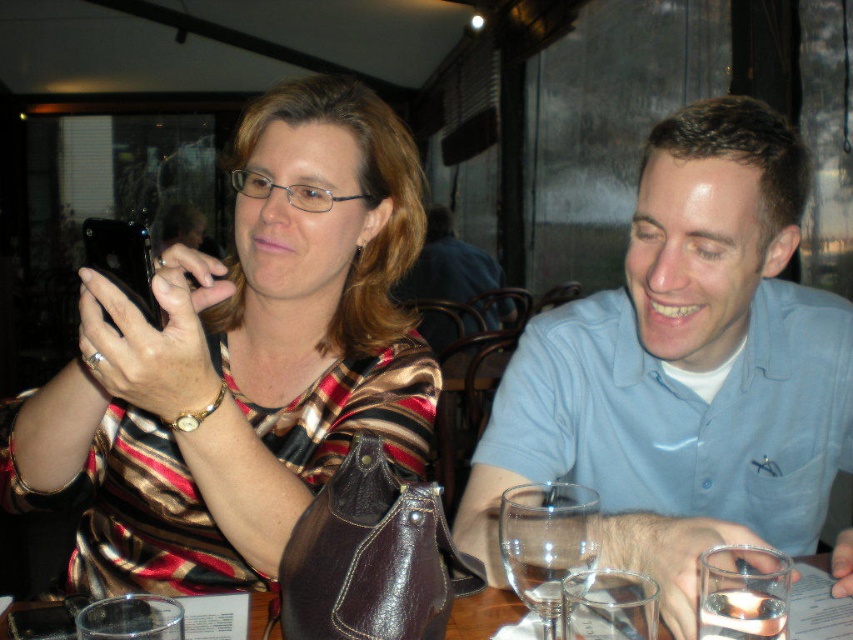
You are a waiter at a restaurant and need to place a 12.5 inch long menu between the blue cotton shirt at center and the transparent glassware at center. Can you fit it there?

The blue cotton shirt at center is 13.03 inches from transparent glassware at center, so yes, the 12.5 inch long menu can fit between them since the distance is sufficient.

You are a waiter at a restaurant. You need to place a dessert menu that is 12 inches wide between the blue cotton shirt at center and the transparent glass at lower center. Can you fit it there?

The distance between the blue cotton shirt at center and the transparent glass at lower center is 13.46 inches. Since the dessert menu is 12 inches wide, it can fit in the space between them.

You are a waiter in a restaurant and need to place a new drink order for the customer wearing the blue cotton shirt at center. Where should you place the drink relative to the transparent glassware at center?

The blue cotton shirt at center is to the right of the transparent glassware at center, so you should place the new drink to the left of the transparent glassware at center to keep it on the opposite side from the customer.